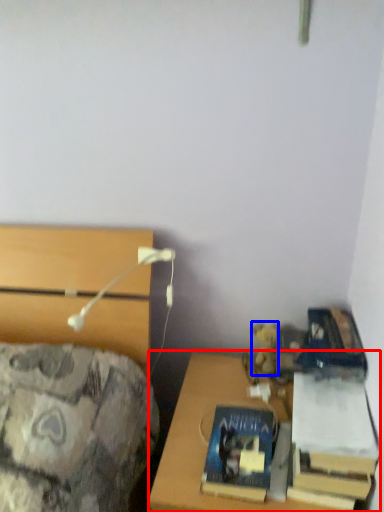
Question: Among these objects, which one is nearest to the camera, desk (highlighted by a red box) or toy (highlighted by a blue box)?

Choices:
 (A) desk
 (B) toy

Answer: (A)